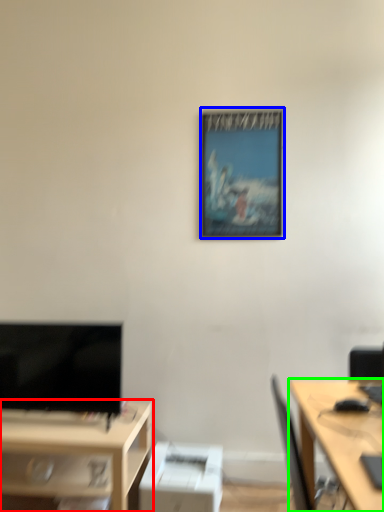
Question: Which object is the closest to the desk (highlighted by a red box)? Choose among these: picture frame (highlighted by a blue box) or desk (highlighted by a green box).

Choices:
 (A) picture frame
 (B) desk

Answer: (B)